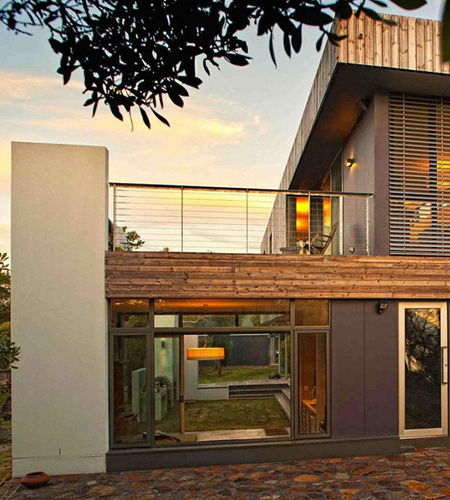
The width and height of the screenshot is (450, 500). In order to click on white wall in this screenshot , I will do `click(55, 255)`.